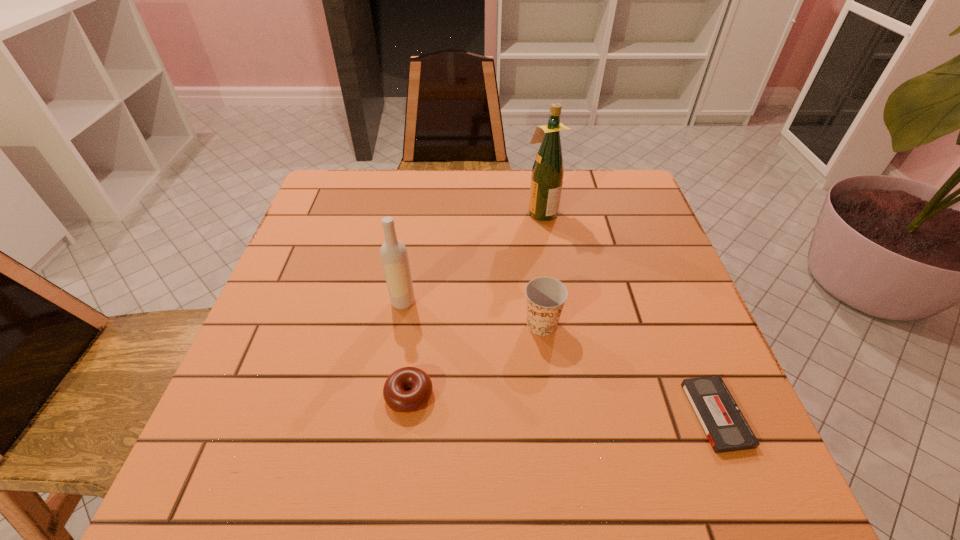
Image resolution: width=960 pixels, height=540 pixels. What are the coordinates of `the farthest object` in the screenshot? It's located at (547, 176).

Find the location of a particular element. the tallest object is located at coordinates (547, 176).

Find the location of a particular element. The width and height of the screenshot is (960, 540). the second tallest object is located at coordinates (393, 252).

Where is `the third shortest object`? The width and height of the screenshot is (960, 540). the third shortest object is located at coordinates (545, 296).

This screenshot has height=540, width=960. What are the coordinates of `the fourth tallest object` in the screenshot? It's located at [395, 396].

The width and height of the screenshot is (960, 540). I want to click on videotape, so click(x=723, y=423).

The height and width of the screenshot is (540, 960). I want to click on the shortest object, so click(723, 423).

Find the location of a particular element. vacant point located on the front-facing side of the liquor is located at coordinates (481, 212).

Identify the location of free space located 0.060m on the front-facing side of the liquor. (503, 212).

I want to click on blank area located 0.380m on the front-facing side of the liquor, so click(x=385, y=212).